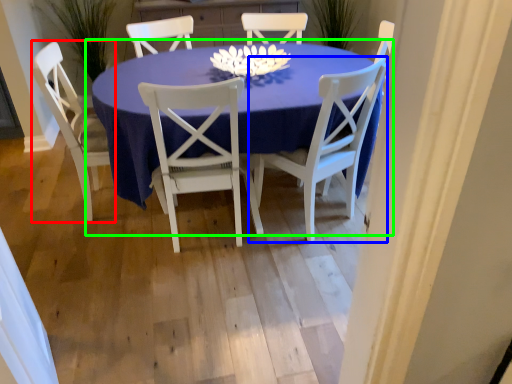
Question: Which object is positioned farthest from chair (highlighted by a red box)? Select from chair (highlighted by a blue box) and kitchen & dining room table (highlighted by a green box).

Choices:
 (A) chair
 (B) kitchen & dining room table

Answer: (A)